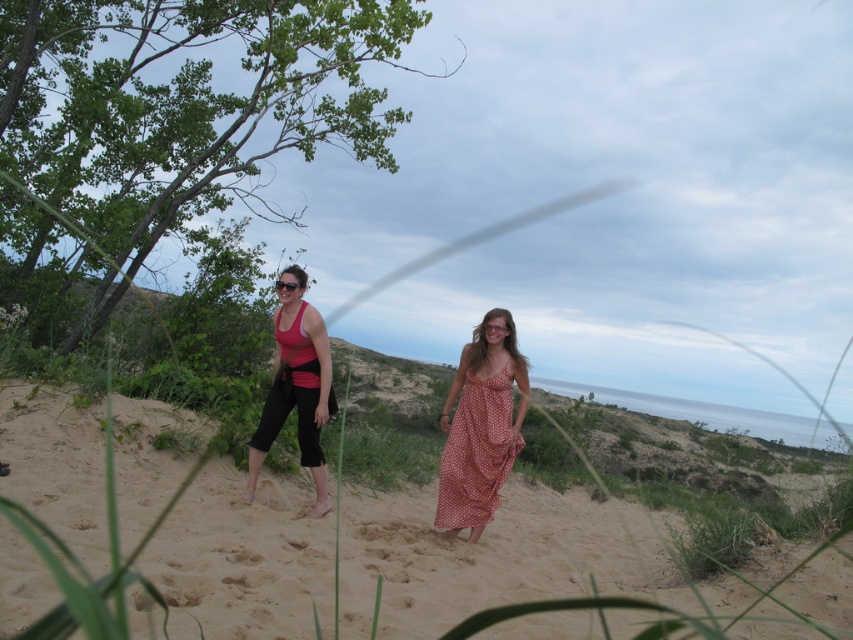
In the scene shown: Is beige sandy beach at center to the left of polka dot fabric dress at center from the viewer's perspective?

Yes, beige sandy beach at center is to the left of polka dot fabric dress at center.

Who is higher up, beige sandy beach at center or polka dot fabric dress at center?

polka dot fabric dress at center is higher up.

Does point (440, 596) come closer to viewer compared to point (482, 449)?

Yes, it is in front of point (482, 449).

Locate an element on the screen. Image resolution: width=853 pixels, height=640 pixels. beige sandy beach at center is located at coordinates (492, 557).

Who is more forward, [276,330] or [486,324]?

Positioned in front is point [486,324].

Does matte pink tank top at center lie behind transparent plastic goggles at center?

No, matte pink tank top at center is in front of transparent plastic goggles at center.

Locate an element on the screen. matte pink tank top at center is located at coordinates (296, 394).

Identify the location of matte pink tank top at center. (296, 394).

Is beige sandy beach at center wider than matte black sunglasses at center?

In fact, beige sandy beach at center might be narrower than matte black sunglasses at center.

The image size is (853, 640). Describe the element at coordinates (492, 557) in the screenshot. I see `beige sandy beach at center` at that location.

The image size is (853, 640). What do you see at coordinates (492, 557) in the screenshot?
I see `beige sandy beach at center` at bounding box center [492, 557].

Locate an element on the screen. The width and height of the screenshot is (853, 640). beige sandy beach at center is located at coordinates (492, 557).